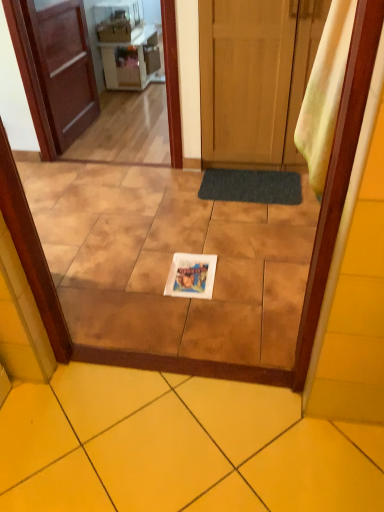
Where is `free point below brown wooden screen door at upper left (from a real-world perspective)`? This screenshot has width=384, height=512. free point below brown wooden screen door at upper left (from a real-world perspective) is located at coordinates (113, 164).